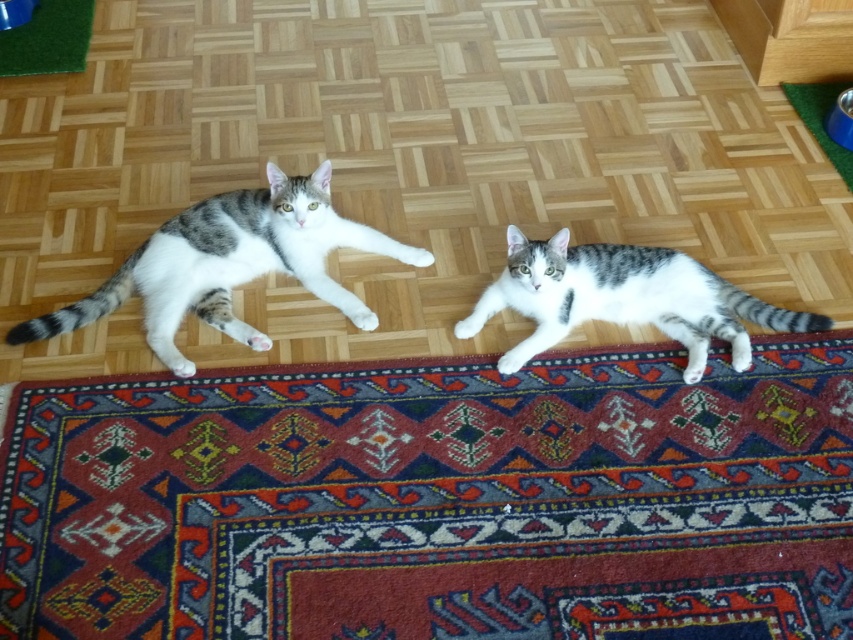
Question: In this image, where is carpet with intricate patterns at center located relative to white-gray fur cat at center?

Choices:
 (A) right
 (B) left

Answer: (B)

Question: In this image, where is carpet with intricate patterns at center located relative to gray-white fur cat at upper center?

Choices:
 (A) above
 (B) below

Answer: (B)

Question: Among these objects, which one is nearest to the camera?

Choices:
 (A) carpet with intricate patterns at center
 (B) green artificial turf at upper left
 (C) white-gray fur cat at center

Answer: (A)

Question: Among these objects, which one is nearest to the camera?

Choices:
 (A) white-gray fur cat at center
 (B) gray-white fur cat at upper center
 (C) carpet with intricate patterns at center
 (D) green artificial turf at upper left

Answer: (C)

Question: Can you confirm if white-gray fur cat at center is positioned below green artificial turf at upper left?

Choices:
 (A) yes
 (B) no

Answer: (A)

Question: Which is farther from the white-gray fur cat at center?

Choices:
 (A) gray-white fur cat at upper center
 (B) green artificial turf at upper left

Answer: (B)